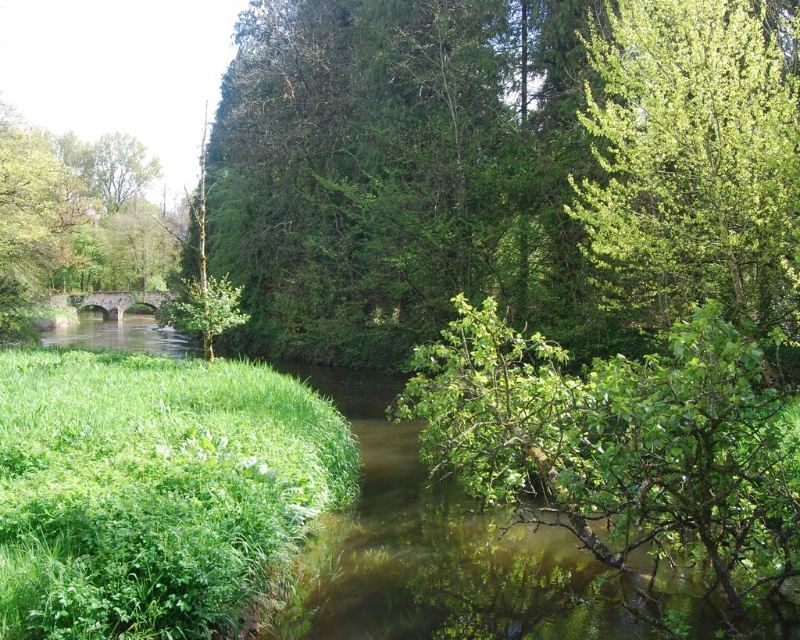
Which is in front, point (336, 140) or point (748, 161)?

Point (748, 161) is more forward.

Does green leafy tree at upper center have a lesser height compared to green leafy tree at upper right?

No, green leafy tree at upper center is not shorter than green leafy tree at upper right.

Which is behind, point (520, 276) or point (752, 320)?

The point (520, 276) is more distant.

Where is `green leafy tree at upper center`? The width and height of the screenshot is (800, 640). green leafy tree at upper center is located at coordinates (400, 173).